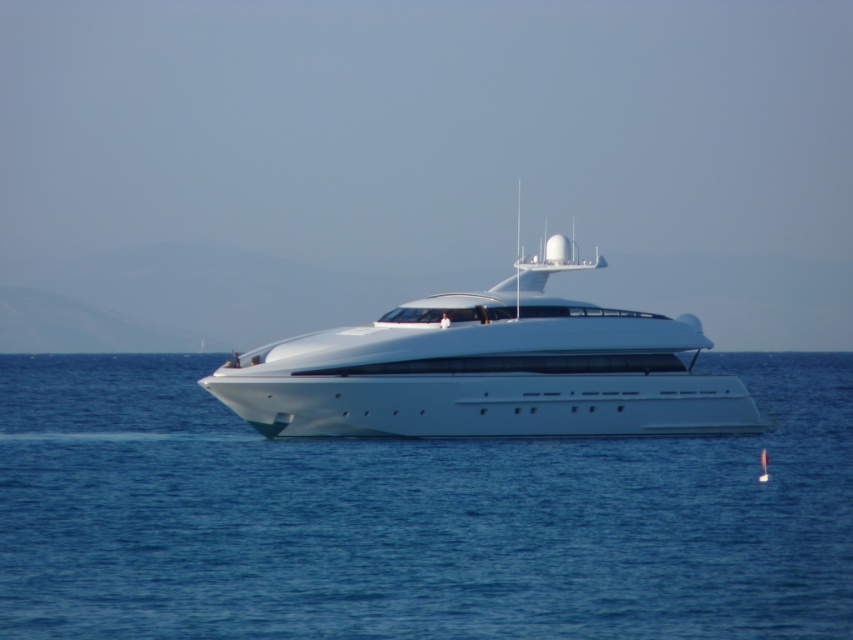
At what (x,y) coordinates should I click in order to perform the action: click on white glossy water at center. Please return your answer as a coordinate pair (x, y). The image size is (853, 640). Looking at the image, I should click on (412, 516).

Is point (137, 509) less distant than point (532, 262)?

Yes.

You are a GUI agent. You are given a task and a screenshot of the screen. Output one action in this format:
    pyautogui.click(x=<x>, y=<y>)
    Task: Click on the white glossy water at center
    The height and width of the screenshot is (640, 853).
    Given the screenshot: What is the action you would take?
    pyautogui.click(x=412, y=516)